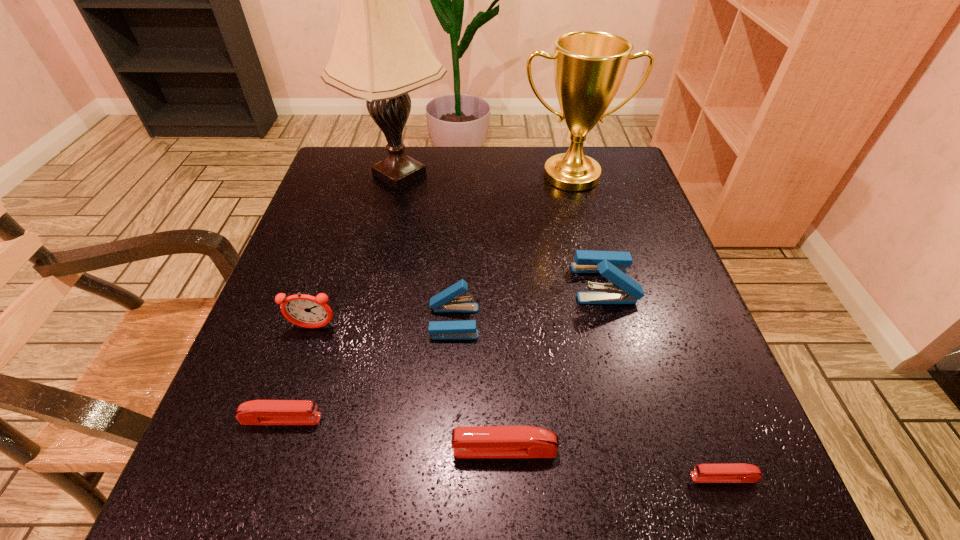
Locate an element on the screen. unoccupied position between the bigger blue stapler and the tallest object is located at coordinates (502, 229).

Locate an element on the screen. Image resolution: width=960 pixels, height=540 pixels. free space between the sixth farthest object and the tallest stapler is located at coordinates (443, 351).

Locate an element on the screen. object that stands as the fifth closest to the left blue stapler is located at coordinates (379, 54).

The height and width of the screenshot is (540, 960). Identify the location of object that stands as the closest to the smaller blue stapler. (303, 310).

In order to click on stapler that is the second nearest to the beige lamp in this screenshot , I will do pyautogui.click(x=612, y=265).

Select which stapler appears as the third closest to the nearest object. Please provide its 2D coordinates. Your answer should be formatted as a tuple, i.e. [(x, y)], where the tuple contains the x and y coordinates of a point satisfying the conditions above.

[(446, 301)]

Identify which red stapler is the second closest to the left blue stapler. Please provide its 2D coordinates. Your answer should be formatted as a tuple, i.e. [(x, y)], where the tuple contains the x and y coordinates of a point satisfying the conditions above.

[(256, 412)]

Locate which red stapler ranks in proximity to the alarm clock. Please provide its 2D coordinates. Your answer should be formatted as a tuple, i.e. [(x, y)], where the tuple contains the x and y coordinates of a point satisfying the conditions above.

[(256, 412)]

The image size is (960, 540). In order to click on vacant area that satisfies the following two spatial constraints: 1. on the front side of the lamp; 2. on the front-facing side of the second smallest red stapler in this screenshot , I will do `click(344, 419)`.

Where is `vacant area that satisfies the following two spatial constraints: 1. by the handles of the gold award; 2. on the front-facing side of the second red stapler from right to left`? vacant area that satisfies the following two spatial constraints: 1. by the handles of the gold award; 2. on the front-facing side of the second red stapler from right to left is located at coordinates (641, 450).